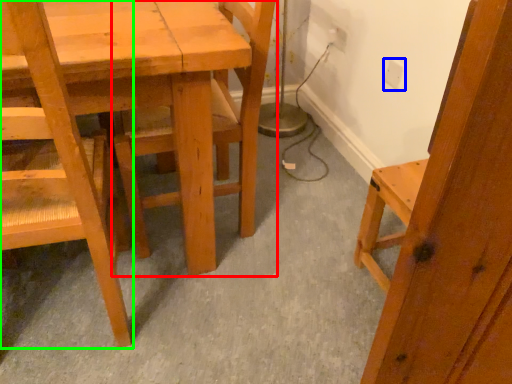
Question: Estimate the real-world distances between objects in this image. Which object is closer to chair (highlighted by a red box), electric outlet (highlighted by a blue box) or chair (highlighted by a green box)?

Choices:
 (A) electric outlet
 (B) chair

Answer: (B)